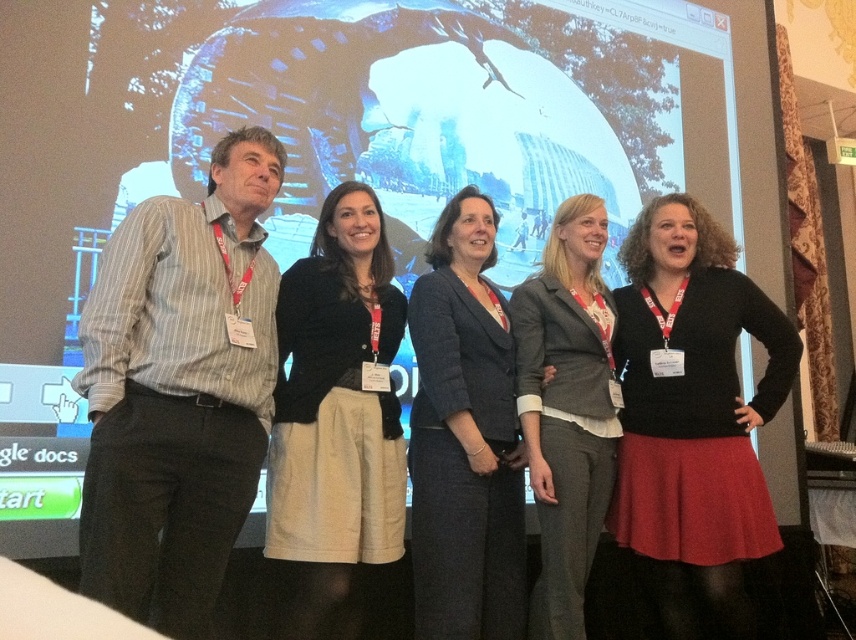
Question: Which object is positioned farthest from the striped cotton shirt at left?

Choices:
 (A) gray wool blazer at center
 (B) black sweater at center
 (C) dark gray suit at center

Answer: (B)

Question: Is striped cotton shirt at left thinner than dark gray suit at center?

Choices:
 (A) no
 (B) yes

Answer: (A)

Question: Is black sweater at center wider than matte black sweater at center?

Choices:
 (A) yes
 (B) no

Answer: (A)

Question: Which of the following is the farthest from the observer?

Choices:
 (A) (300, 401)
 (B) (712, 532)
 (C) (438, 390)
 (D) (518, 321)

Answer: (D)

Question: Among these points, which one is farthest from the camera?

Choices:
 (A) (389, 346)
 (B) (516, 518)
 (C) (758, 401)
 (D) (551, 406)

Answer: (C)

Question: Is the position of black sweater at center less distant than that of matte black sweater at center?

Choices:
 (A) no
 (B) yes

Answer: (A)